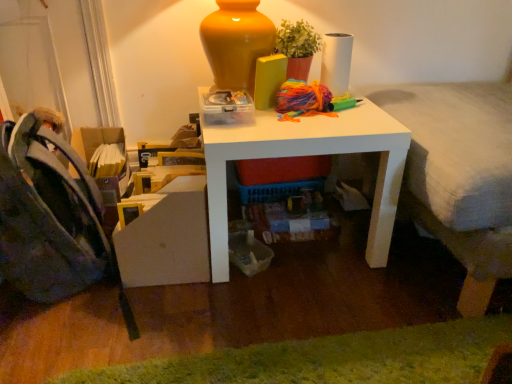
Locate an element on the screen. The width and height of the screenshot is (512, 384). free spot in front of dark blue fabric folding chair at left is located at coordinates (62, 341).